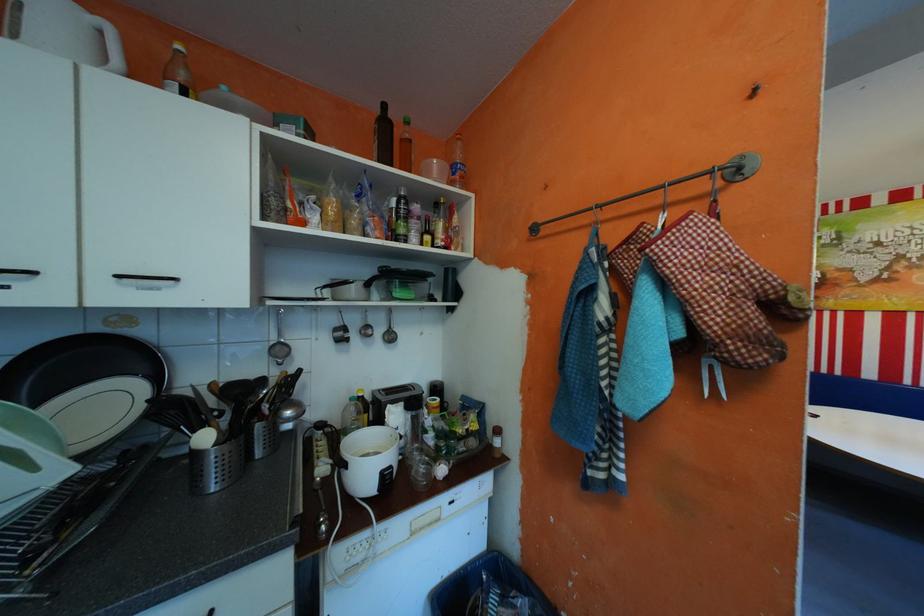
The location [278,342] corresponds to which object?

This point indicates the metal ladle.